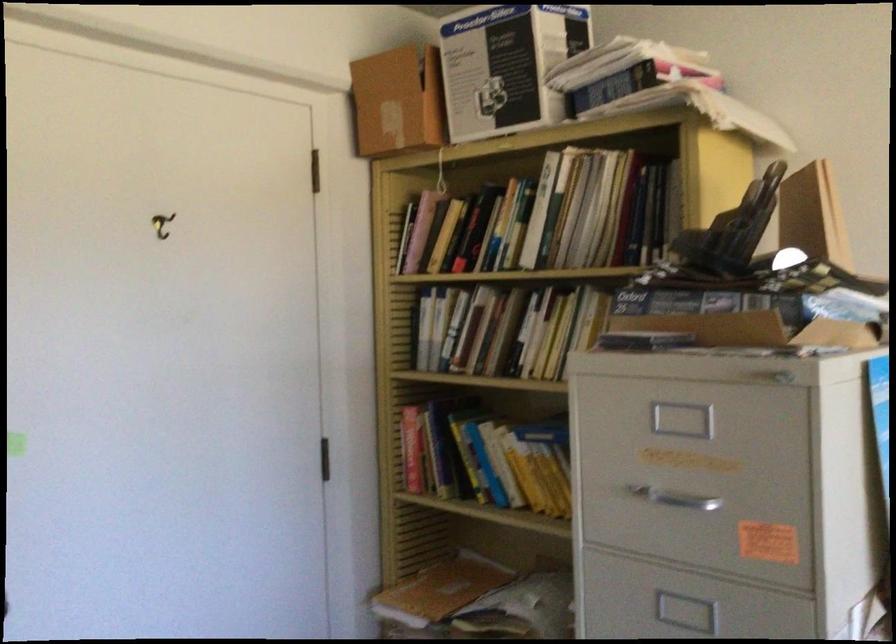
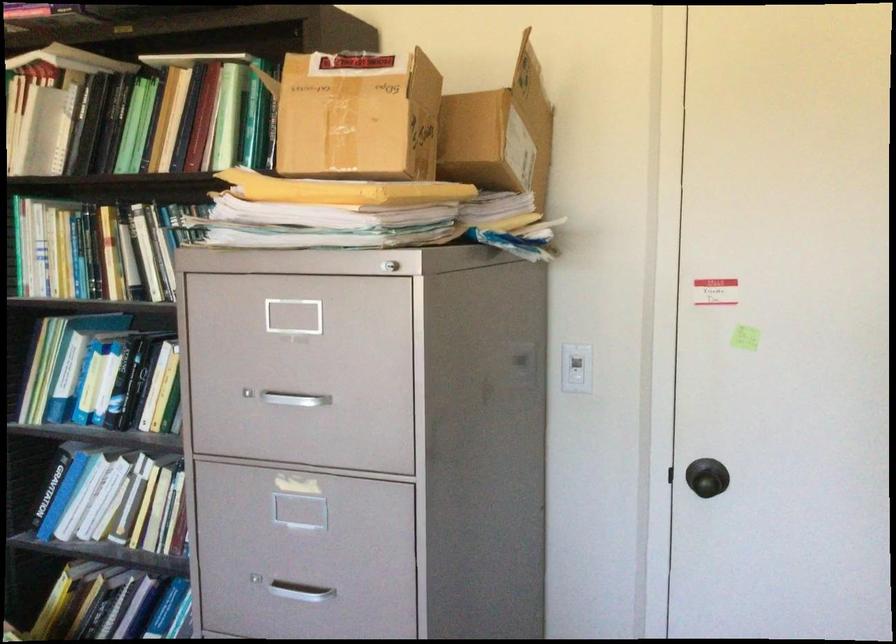
Question: The images are taken continuously from a first-person perspective. In which direction is your viewpoint rotating?

Choices:
 (A) Left
 (B) Right
 (C) Up
 (D) Down

Answer: (A)